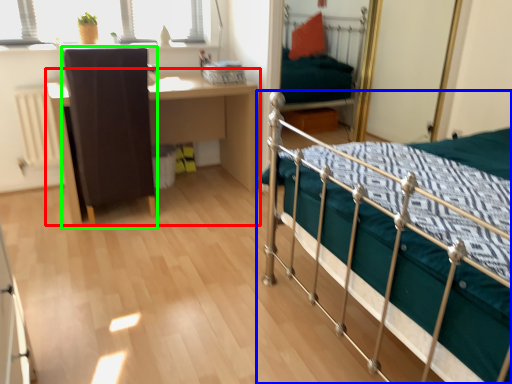
Question: Which object is positioned closest to desk (highlighted by a red box)? Select from bed (highlighted by a blue box) and chair (highlighted by a green box).

Choices:
 (A) bed
 (B) chair

Answer: (B)